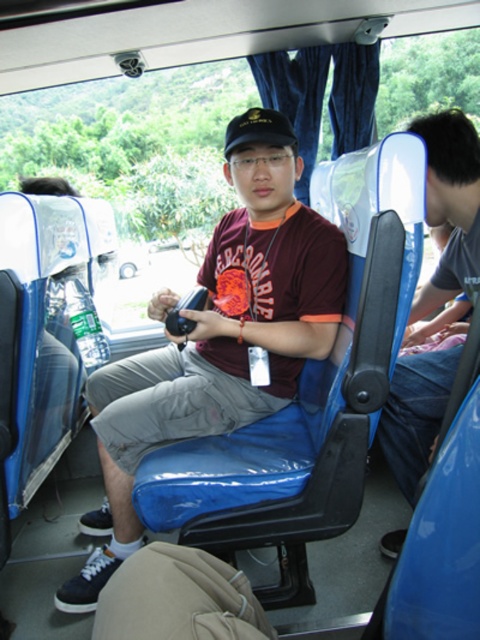
Who is lower down, matte black shirt at center or matte blue shirt at center?

matte black shirt at center is lower down.

Between point (132, 424) and point (433, 422), which one is positioned in front?

Point (132, 424) is in front.

The image size is (480, 640). What are the coordinates of `matte black shirt at center` in the screenshot? It's located at (217, 346).

Can you confirm if matte black shirt at center is thinner than black fabric baseball hat at center?

Incorrect, matte black shirt at center's width is not less than black fabric baseball hat at center's.

Which is in front, point (226, 355) or point (260, 131)?

Point (260, 131) is more forward.

At what (x,y) coordinates should I click in order to perform the action: click on matte black shirt at center. Please return your answer as a coordinate pair (x, y). Looking at the image, I should click on (217, 346).

Can you confirm if matte blue shirt at center is taller than black fabric baseball hat at center?

Correct, matte blue shirt at center is much taller as black fabric baseball hat at center.

Is point (459, 248) positioned before point (272, 144)?

No, it is not.

Describe the element at coordinates (450, 204) in the screenshot. Image resolution: width=480 pixels, height=640 pixels. I see `matte blue shirt at center` at that location.

Where is `matte blue shirt at center`? The width and height of the screenshot is (480, 640). matte blue shirt at center is located at coordinates (450, 204).